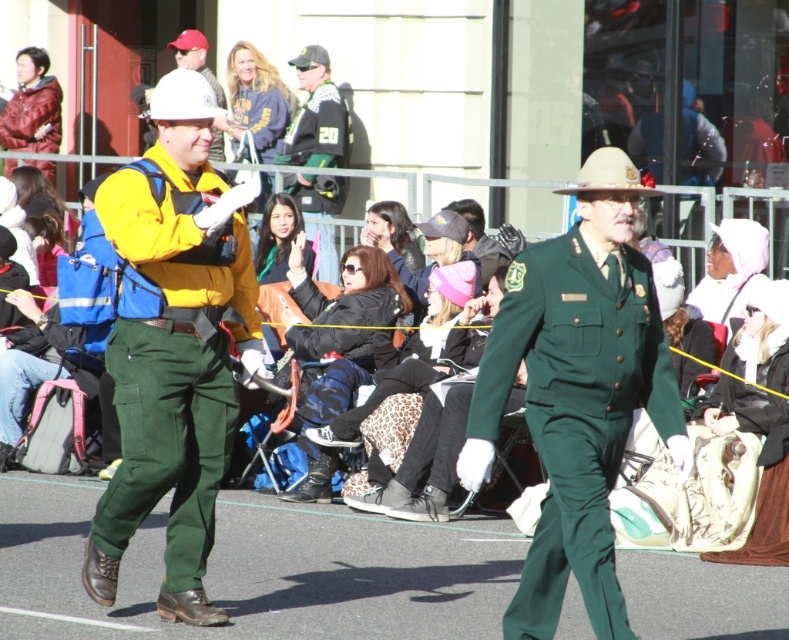
Question: Which of these objects is positioned farthest from the white matte hard hat at upper center?

Choices:
 (A) green uniform at center
 (B) green cotton pants at left

Answer: (A)

Question: Based on their relative distances, which object is farther from the green uniform at center?

Choices:
 (A) white matte hard hat at upper center
 (B) green cotton pants at left

Answer: (A)

Question: Can you confirm if green uniform at center is wider than green cotton pants at left?

Choices:
 (A) no
 (B) yes

Answer: (B)

Question: Can you confirm if green uniform at center is smaller than green cotton pants at left?

Choices:
 (A) yes
 (B) no

Answer: (B)

Question: Is green uniform at center above green cotton pants at left?

Choices:
 (A) no
 (B) yes

Answer: (A)

Question: Which object appears closest to the camera in this image?

Choices:
 (A) green cotton pants at left
 (B) white matte hard hat at upper center
 (C) green uniform at center

Answer: (C)